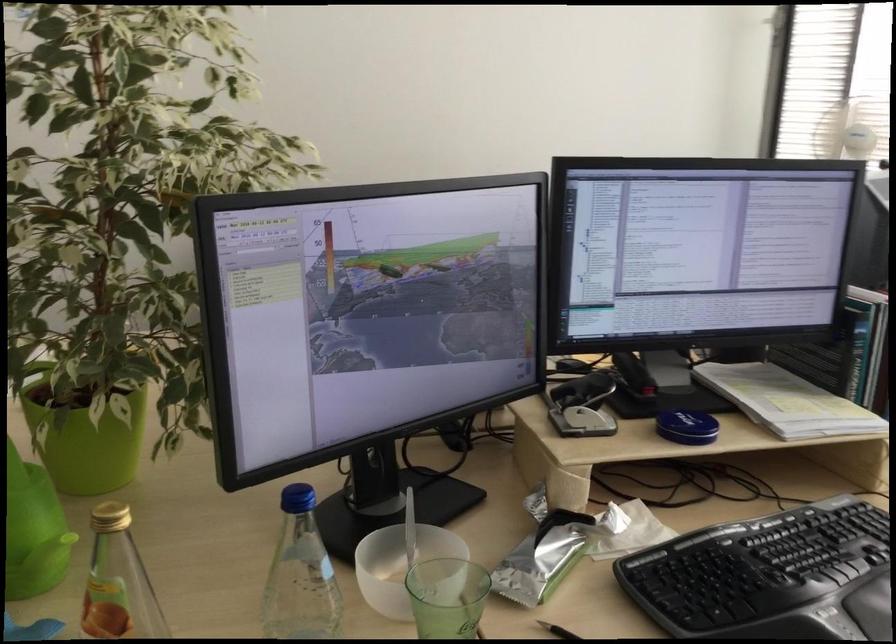
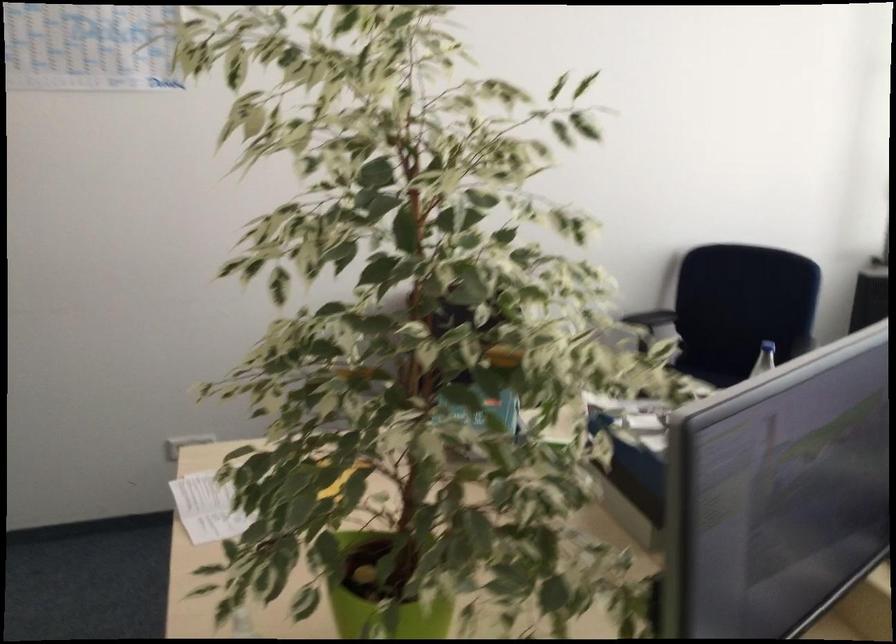
The images are taken continuously from a first-person perspective. In which direction are you moving?

The movement direction of the cameraman is left, forward.